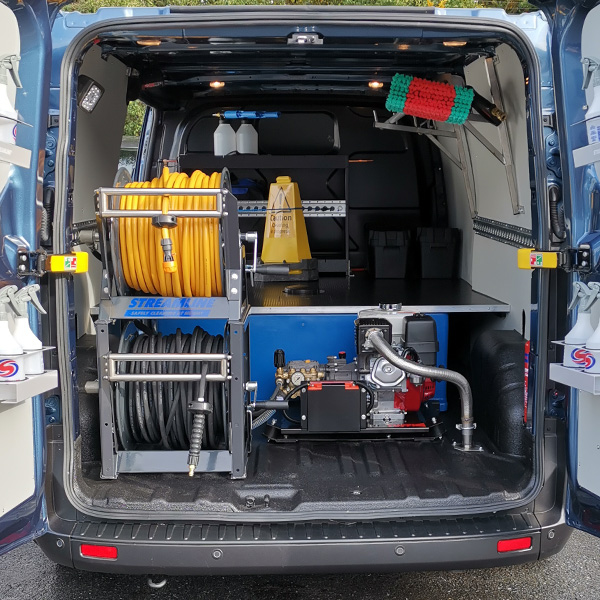
Find the location of a particular element. This screenshot has width=600, height=600. spray bottles on inside of left door is located at coordinates (3, 340), (22, 338).